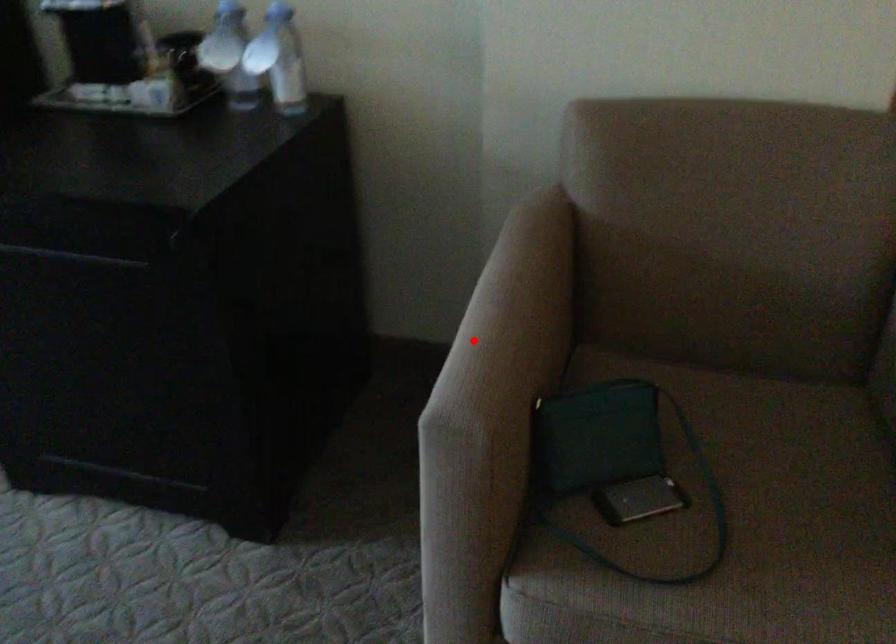
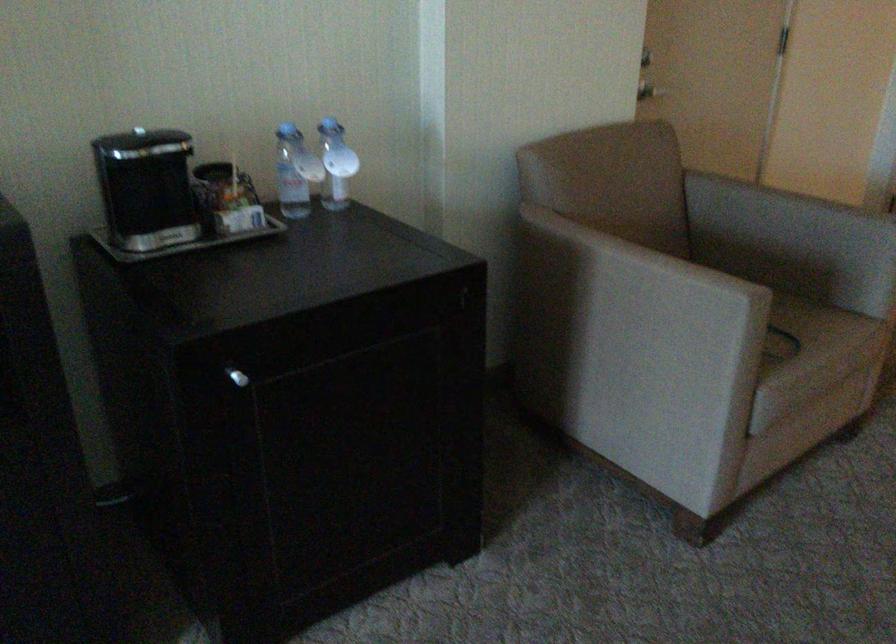
In the second image, find the point that corresponds to the highlighted location in the first image.

(631, 283)